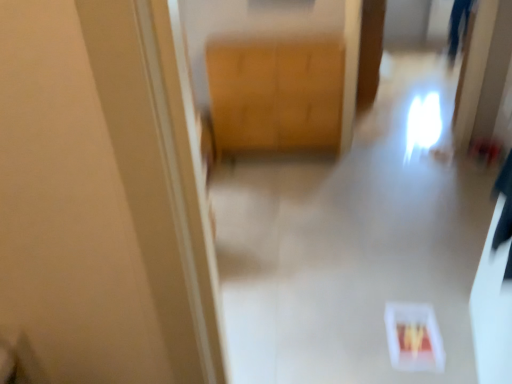
Question: In terms of height, does white plastic container at lower center look taller or shorter compared to wooden cabinet at center?

Choices:
 (A) tall
 (B) short

Answer: (B)

Question: Does point (246, 172) appear closer or farther from the camera than point (339, 41)?

Choices:
 (A) farther
 (B) closer

Answer: (A)

Question: From a real-world perspective, is white plastic container at lower center positioned above or below wooden cabinet at center?

Choices:
 (A) below
 (B) above

Answer: (A)

Question: Is wooden cabinet at center spatially inside white plastic container at lower center, or outside of it?

Choices:
 (A) outside
 (B) inside

Answer: (A)

Question: Would you say wooden cabinet at center is to the left or to the right of white plastic container at lower center in the picture?

Choices:
 (A) right
 (B) left

Answer: (B)

Question: From the image's perspective, relative to white plastic container at lower center, is wooden cabinet at center above or below?

Choices:
 (A) below
 (B) above

Answer: (B)

Question: Considering the positions of wooden cabinet at center and white plastic container at lower center in the image, is wooden cabinet at center taller or shorter than white plastic container at lower center?

Choices:
 (A) short
 (B) tall

Answer: (B)